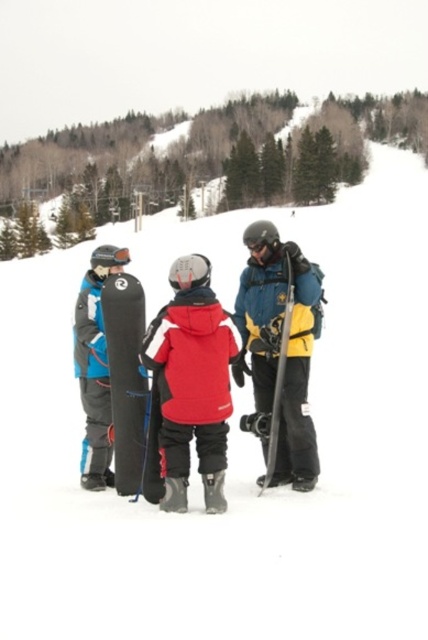
Is point (142, 436) positioned in front of point (269, 448)?

Yes, it is in front of point (269, 448).

Between black matte snowboard at center and matte black snowboard at center, which one appears on the left side from the viewer's perspective?

From the viewer's perspective, black matte snowboard at center appears more on the left side.

Does point (104, 292) lie in front of point (279, 340)?

That is True.

Find the location of a particular element. The image size is (428, 640). black matte snowboard at center is located at coordinates (125, 378).

Can you confirm if matte red jacket at center is smaller than black matte snowboard at center?

Actually, matte red jacket at center might be larger than black matte snowboard at center.

Is point (171, 422) positioned behind point (124, 417)?

No, it is not.

I want to click on matte red jacket at center, so click(x=189, y=387).

Locate an element on the screen. matte red jacket at center is located at coordinates [189, 387].

Can you confirm if matte red jacket at center is positioned to the left of matte blue snowboard at right?

Indeed, matte red jacket at center is positioned on the left side of matte blue snowboard at right.

Describe the element at coordinates (189, 387) in the screenshot. The height and width of the screenshot is (640, 428). I see `matte red jacket at center` at that location.

Find the location of a particular element. matte red jacket at center is located at coordinates (189, 387).